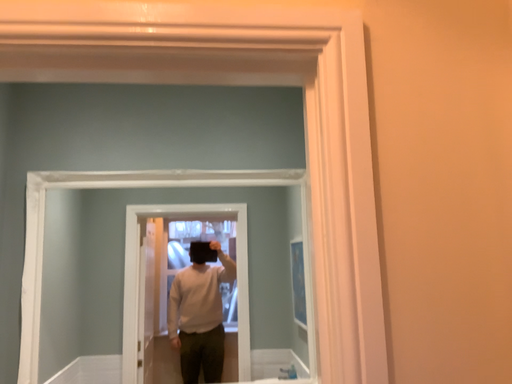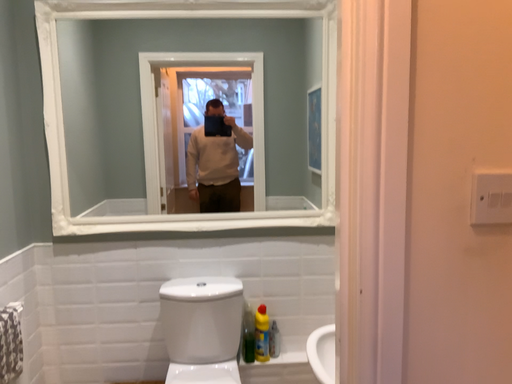
Question: Which way did the camera rotate in the video?

Choices:
 (A) rotated downward
 (B) rotated upward

Answer: (A)